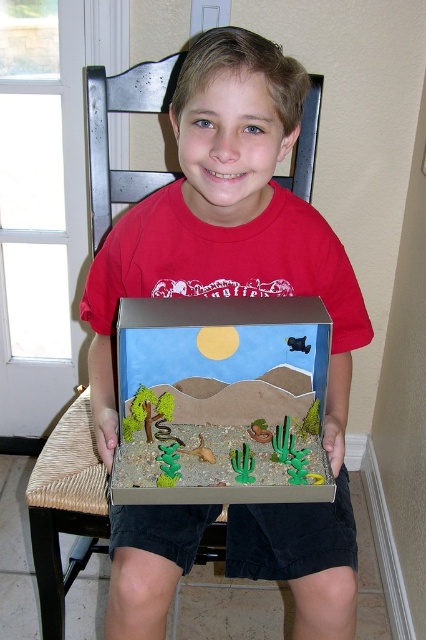
You are a delivery robot with a 10 cm wide arm. You need to place a package between the matte cardboard box at center and the cardboard diorama at center. Can your arm fit through the space between them?

The distance between the matte cardboard box at center and the cardboard diorama at center is 11.20 centimeters, so yes, the robot can fit its 10 cm wide arm between them.

The boy is holding two items in the scene. Which one is positioned higher? The matte cardboard box at center or the cardboard diorama at center?

The matte cardboard box at center is above the cardboard diorama at center, so the matte cardboard box at center is positioned higher.

The user is trying to determine the correct order of objects in the image. Which object is closer to the viewer between the matte cardboard box at center and the cardboard diorama at center?

The matte cardboard box at center is closer to the viewer than the cardboard diorama at center.